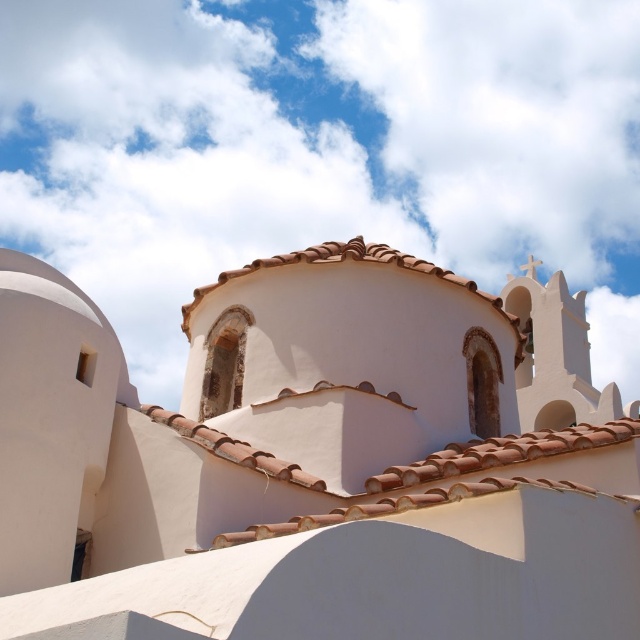
You are an architect analyzing the building structure. You notice the white fluffy cloud at upper center and the brown clay tiles at upper center in the image. Which object appears closer to you in the scene?

The white fluffy cloud at upper center appears closer to you because it is further to the viewer than the brown clay tiles at upper center.

You are an architect analyzing the building. You notice the white matte dome at center and the white fluffy cloud at upper center. Which of these two objects appears smaller in width when viewed from your perspective?

The white matte dome at center has a lesser width compared to the white fluffy cloud at upper center, so the dome appears smaller in width than the cloud.

You are standing in front of a white building with a dome. There is a point marked at coordinates (316, 460). What object is located at that point?

The point at coordinates (316, 460) is where the white matte dome at center is located.